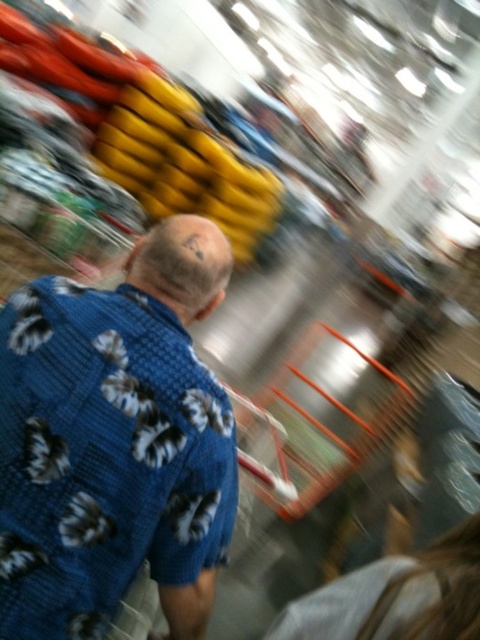
Question: Is blue floral shirt at center closer to camera compared to blonde hair at lower right?

Choices:
 (A) yes
 (B) no

Answer: (B)

Question: Is blue floral shirt at center further to camera compared to blonde hair at lower right?

Choices:
 (A) no
 (B) yes

Answer: (B)

Question: Does blue floral shirt at center appear over blonde hair at lower right?

Choices:
 (A) yes
 (B) no

Answer: (A)

Question: Which point is closer to the camera?

Choices:
 (A) (372, 627)
 (B) (35, 484)

Answer: (A)